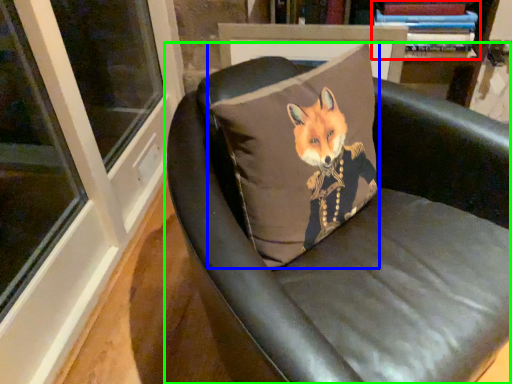
Question: Estimate the real-world distances between objects in this image. Which object is farther from book (highlighted by a red box), pillow (highlighted by a blue box) or chair (highlighted by a green box)?

Choices:
 (A) pillow
 (B) chair

Answer: (B)